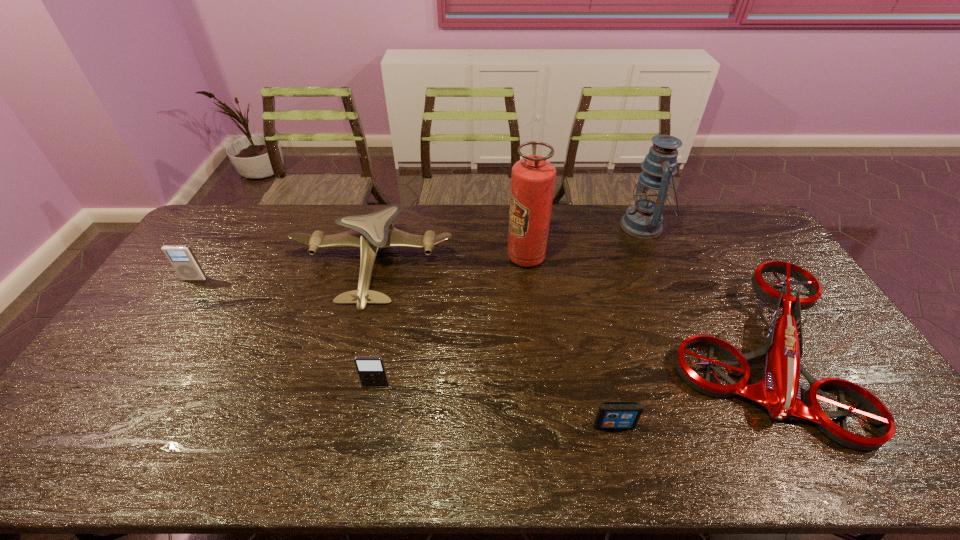
The height and width of the screenshot is (540, 960). What are the coordinates of `vacant area that satisfies the following two spatial constraints: 1. on the front-facing side of the lantern; 2. on the right side of the right drone` in the screenshot? It's located at (699, 353).

Where is `vacant position in the image that satisfies the following two spatial constraints: 1. on the front-facing side of the right drone; 2. on the left side of the lantern`? vacant position in the image that satisfies the following two spatial constraints: 1. on the front-facing side of the right drone; 2. on the left side of the lantern is located at coordinates (699, 353).

You are a GUI agent. You are given a task and a screenshot of the screen. Output one action in this format:
    pyautogui.click(x=<x>, y=<y>)
    Task: Click on the vacant space that satisfies the following two spatial constraints: 1. on the front-facing side of the right drone; 2. on the right side of the lantern
    Image resolution: width=960 pixels, height=540 pixels.
    Given the screenshot: What is the action you would take?
    pyautogui.click(x=699, y=353)

Find the location of a particular element. The image size is (960, 540). vacant position in the image that satisfies the following two spatial constraints: 1. on the front-facing side of the lantern; 2. on the back side of the right drone is located at coordinates (699, 353).